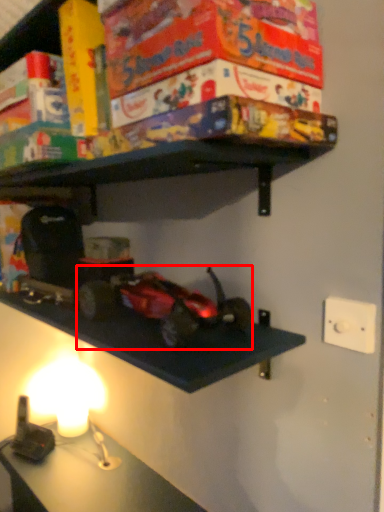
Question: In this image, where is toy (annotated by the red box) located relative to light switch?

Choices:
 (A) right
 (B) left

Answer: (B)